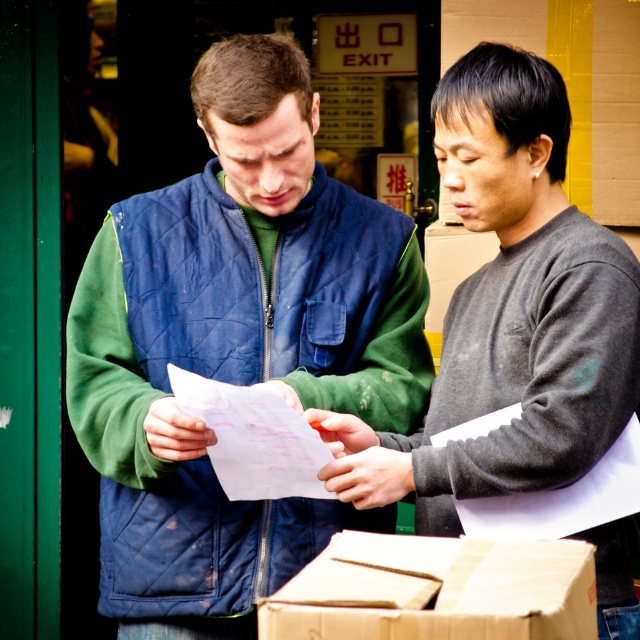
Does gray matte sweater at center lie behind brown cardboard box at lower center?

Yes, gray matte sweater at center is further from the viewer.

Is point (497, 273) farther from viewer compared to point (417, 616)?

Yes, point (497, 273) is farther from viewer.

Who is more distant from viewer, (x=449, y=83) or (x=438, y=636)?

The point (x=449, y=83) is behind.

Where is `gray matte sweater at center`? The width and height of the screenshot is (640, 640). gray matte sweater at center is located at coordinates (509, 310).

Between blue quilted vest at center and white paper at center, which one has more height?

blue quilted vest at center is taller.

Which is more to the left, blue quilted vest at center or white paper at center?

blue quilted vest at center is more to the left.

What are the coordinates of `blue quilted vest at center` in the screenshot? It's located at (234, 346).

Does gray matte sweater at center have a greater width compared to white paper at center?

Correct, the width of gray matte sweater at center exceeds that of white paper at center.

Which is in front, point (552, 221) or point (224, 474)?

Positioned in front is point (552, 221).

Identify the location of gray matte sweater at center. (509, 310).

This screenshot has height=640, width=640. I want to click on gray matte sweater at center, so click(509, 310).